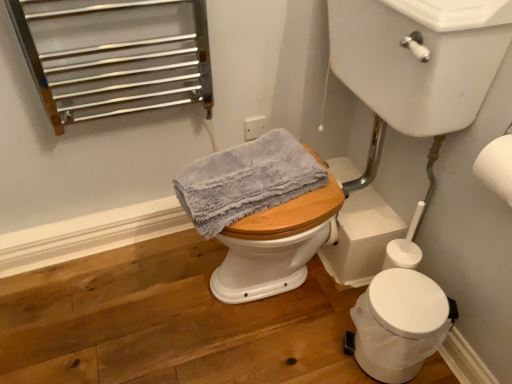
This screenshot has height=384, width=512. Identify the location of free space to the left of white glossy sink at upper right. (148, 304).